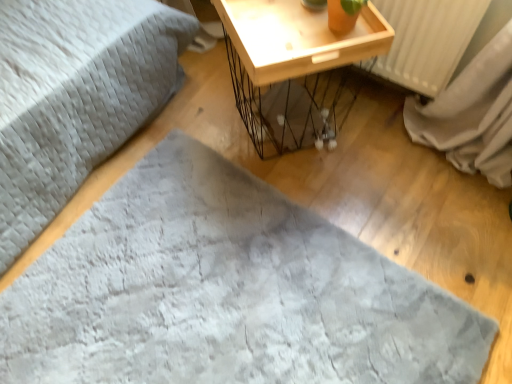
Question: In terms of height, does gray soft fabric at center look taller or shorter compared to wooden tray at upper right?

Choices:
 (A) tall
 (B) short

Answer: (B)

Question: Is gray soft fabric at center in front of or behind wooden tray at upper right in the image?

Choices:
 (A) behind
 (B) front

Answer: (B)

Question: From the image's perspective, is gray soft fabric at center above or below wooden tray at upper right?

Choices:
 (A) below
 (B) above

Answer: (A)

Question: In the image, is wooden tray at upper right positioned in front of or behind gray soft fabric at center?

Choices:
 (A) front
 (B) behind

Answer: (B)

Question: Considering the positions of wooden tray at upper right and gray soft fabric at center in the image, is wooden tray at upper right taller or shorter than gray soft fabric at center?

Choices:
 (A) tall
 (B) short

Answer: (A)

Question: Based on their sizes in the image, would you say wooden tray at upper right is bigger or smaller than gray soft fabric at center?

Choices:
 (A) big
 (B) small

Answer: (A)

Question: Would you say wooden tray at upper right is to the left or to the right of gray soft fabric at center in the picture?

Choices:
 (A) right
 (B) left

Answer: (A)